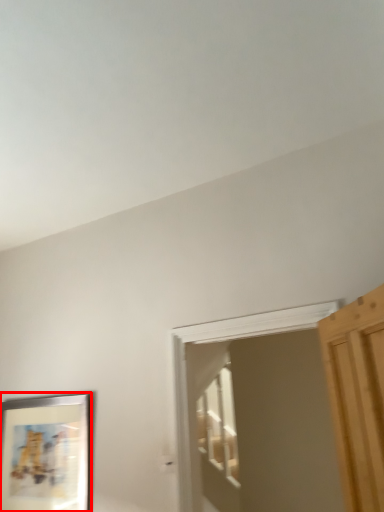
Question: From the image's perspective, considering the relative positions of picture frame (annotated by the red box) and screen door in the image provided, where is picture frame (annotated by the red box) located with respect to the staircase?

Choices:
 (A) above
 (B) below

Answer: (B)